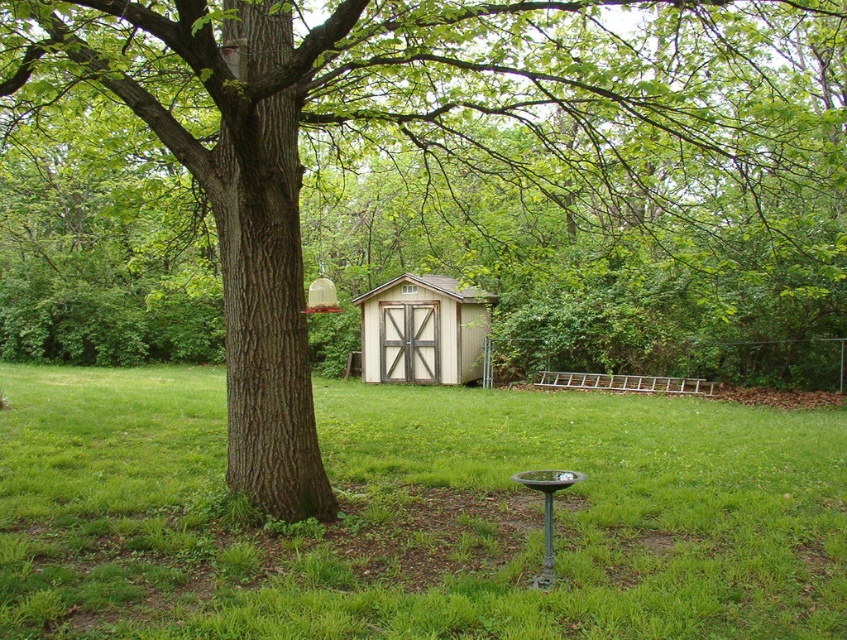
You are standing in the backyard and want to place a new garden bench. You have two options for placement. One spot is on the green grass at center and the other is next to the light brown wooden shed at center. Based on the scene, which location would be higher in elevation?

The light brown wooden shed at center is higher than the green grass at center, so placing the bench next to the shed would be on a higher elevation.

You are planning to mow the lawn in the backyard. You see the green grass at center and the light brown wooden shed at center. Which area should you avoid mowing to prevent damaging the shed?

You should avoid mowing near the light brown wooden shed at center because the green grass at center is shorter than the shed, meaning the shed is taller and could be damaged by the mower if approached too closely.

You are planning to place a new garden bench in the backyard. The bench requires a flat area larger than the light brown wooden shed at center. Can the green grass at center accommodate the bench?

The green grass at center is bigger than the light brown wooden shed at center, so yes, the green grass at center can accommodate the bench as it has a larger flat area than the shed.